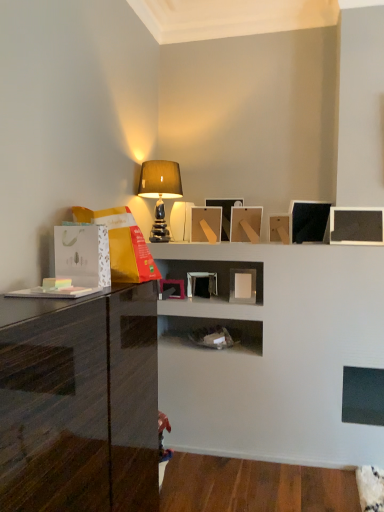
Where is `matte beige lampshade at upper center`? The height and width of the screenshot is (512, 384). matte beige lampshade at upper center is located at coordinates (160, 192).

Is glossy black cabinet at left not within matte beige lampshade at upper center?

glossy black cabinet at left is positioned outside matte beige lampshade at upper center.

In terms of size, does glossy black cabinet at left appear bigger or smaller than matte beige lampshade at upper center?

In the image, glossy black cabinet at left appears to be larger than matte beige lampshade at upper center.

Who is more distant, glossy black cabinet at left or matte beige lampshade at upper center?

matte beige lampshade at upper center is behind.

From the picture: Considering the sizes of objects matte beige lampshade at upper center and matte wood picture frame at center in the image provided, who is thinner, matte beige lampshade at upper center or matte wood picture frame at center?

matte wood picture frame at center is thinner.

Does matte beige lampshade at upper center appear on the right side of matte wood picture frame at center?

No.

From a real-world perspective, which object rests below the other?

matte wood picture frame at center is physically lower.

How different are the orientations of matte beige lampshade at upper center and matte wood picture frame at center in degrees?

177 degrees separate the facing orientations of matte beige lampshade at upper center and matte wood picture frame at center.

From a real-world perspective, is matte wood picture frame at center positioned over matte beige lampshade at upper center based on gravity?

No.

From the image's perspective, which one is positioned lower, matte wood picture frame at center or matte beige lampshade at upper center?

matte wood picture frame at center appears lower in the image.

Is matte wood picture frame at center with matte beige lampshade at upper center?

No, matte wood picture frame at center is not beside matte beige lampshade at upper center.

Between matte beige lampshade at upper center and glossy black cabinet at left, which one appears on the left side from the viewer's perspective?

glossy black cabinet at left.

Looking at the image, does matte beige lampshade at upper center seem bigger or smaller compared to glossy black cabinet at left?

In the image, matte beige lampshade at upper center appears to be smaller than glossy black cabinet at left.

Can you see matte beige lampshade at upper center touching glossy black cabinet at left?

No, matte beige lampshade at upper center is not next to glossy black cabinet at left.

From the image's perspective, which is below, matte wood picture frame at center or glossy black cabinet at left?

glossy black cabinet at left appears lower in the image.

Is matte wood picture frame at center bigger or smaller than glossy black cabinet at left?

matte wood picture frame at center is smaller than glossy black cabinet at left.

Visually, is matte wood picture frame at center positioned to the left or to the right of glossy black cabinet at left?

Based on their positions, matte wood picture frame at center is located to the right of glossy black cabinet at left.

Is matte wood picture frame at center oriented away from glossy black cabinet at left?

No.

Looking at this image, is glossy black cabinet at left taller or shorter than matte wood picture frame at center?

Considering their sizes, glossy black cabinet at left has more height than matte wood picture frame at center.

Considering the points (128, 435) and (219, 201), which point is behind, point (128, 435) or point (219, 201)?

The point (219, 201) is more distant.

The width and height of the screenshot is (384, 512). Identify the location of cabinetry in front of the matte wood picture frame at center. (79, 404).

Considering the relative positions of glossy black cabinet at left and matte wood picture frame at center in the image provided, is glossy black cabinet at left in front of matte wood picture frame at center?

That is True.

Where is `lamp above the glossy black cabinet at left (from the image's perspective)`? The image size is (384, 512). lamp above the glossy black cabinet at left (from the image's perspective) is located at coordinates (160, 192).

Find the location of `picture frame behind the matte beige lampshade at upper center`. picture frame behind the matte beige lampshade at upper center is located at coordinates (225, 213).

Based on their spatial positions, is matte beige lampshade at upper center or glossy black cabinet at left closer to matte wood picture frame at center?

matte beige lampshade at upper center is closer to matte wood picture frame at center.

Which object lies further to the anchor point matte beige lampshade at upper center, glossy black cabinet at left or matte wood picture frame at center?

glossy black cabinet at left lies further to matte beige lampshade at upper center than the other object.

Consider the image. Which object lies further to the anchor point glossy black cabinet at left, matte wood picture frame at center or matte beige lampshade at upper center?

matte wood picture frame at center is further to glossy black cabinet at left.

Looking at the image, which one is located further to matte wood picture frame at center, glossy black cabinet at left or matte beige lampshade at upper center?

The object further to matte wood picture frame at center is glossy black cabinet at left.

Which object lies further to the anchor point glossy black cabinet at left, matte beige lampshade at upper center or matte wood picture frame at center?

matte wood picture frame at center.

Considering their positions, is matte wood picture frame at center positioned closer to matte beige lampshade at upper center than glossy black cabinet at left?

Based on the image, matte wood picture frame at center appears to be nearer to matte beige lampshade at upper center.

The image size is (384, 512). In order to click on lamp located between glossy black cabinet at left and matte wood picture frame at center in the depth direction in this screenshot , I will do `click(160, 192)`.